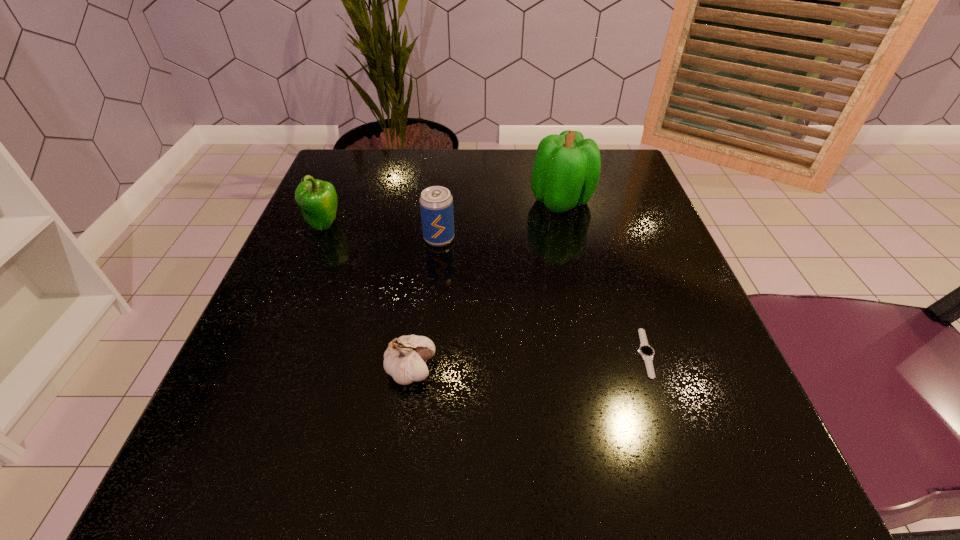
You are a GUI agent. You are given a task and a screenshot of the screen. Output one action in this format:
    pyautogui.click(x=<x>, y=<y>)
    Task: Click on the vacant space located on the right of the garlic
    This screenshot has height=540, width=960.
    Given the screenshot: What is the action you would take?
    pyautogui.click(x=557, y=370)

I want to click on free space located 0.190m on the left of the shortest object, so coord(507,353).

Find the location of a particular element. object present at the far edge is located at coordinates (566, 170).

Where is `object that is at the left edge`? object that is at the left edge is located at coordinates (317, 199).

Locate an element on the screen. Image resolution: width=960 pixels, height=540 pixels. bell pepper that is at the right edge is located at coordinates (x=566, y=170).

Where is `watch present at the right edge`? watch present at the right edge is located at coordinates (646, 352).

The width and height of the screenshot is (960, 540). What are the coordinates of `object located in the far right corner section of the desktop` in the screenshot? It's located at (566, 170).

What are the coordinates of `vacant region at the far edge of the desktop` in the screenshot? It's located at (431, 185).

At what (x,y) coordinates should I click in order to perform the action: click on vacant space at the near edge of the desktop. Please return your answer as a coordinate pair (x, y). Looking at the image, I should click on (368, 484).

You are a GUI agent. You are given a task and a screenshot of the screen. Output one action in this format:
    pyautogui.click(x=<x>, y=<y>)
    Task: Click on the vacant point at the left edge
    
    Given the screenshot: What is the action you would take?
    click(x=338, y=208)